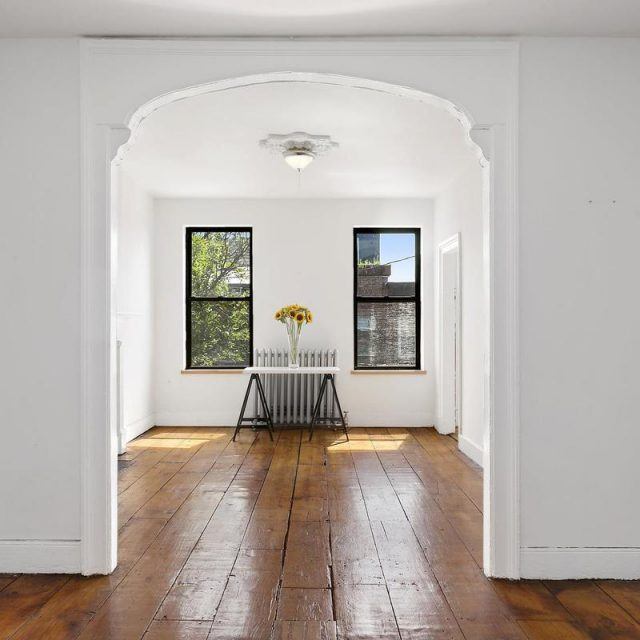
At what (x,y) coordinates should I click in order to perform the action: click on window frame. Please return your answer as a coordinate pair (x, y). The height and width of the screenshot is (640, 640). Looking at the image, I should click on [x=368, y=301], [x=216, y=299].